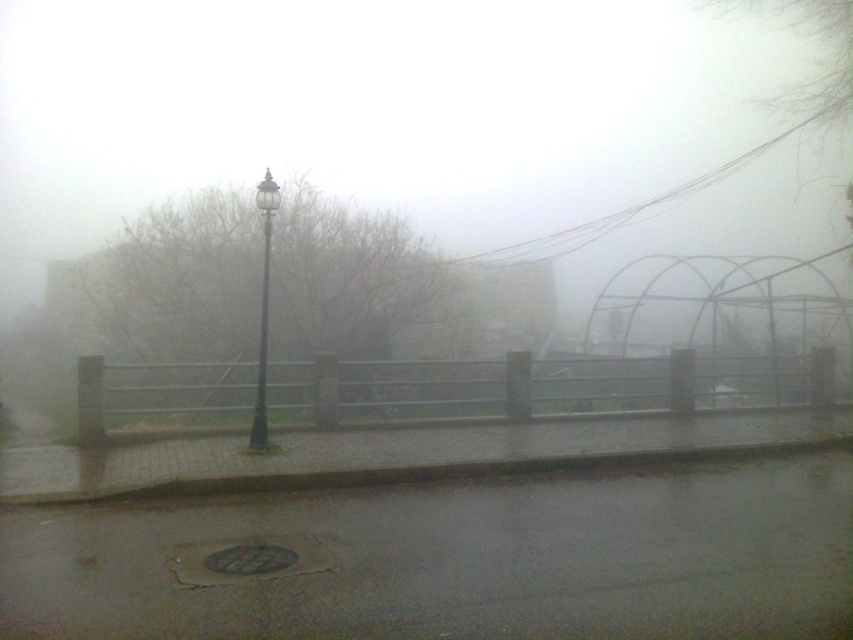
You are a delivery person with a cart that is 5 meters wide. You need to move from the wet asphalt at lower center to the black polished pole at center. Can your cart fit through the space between them?

The distance between the wet asphalt at lower center and the black polished pole at center is 5.03 meters, so the cart which is 5 meters wide can fit through the space between them as it is slightly wider than the cart.

You are a delivery person trying to avoid getting your shoes wet. You see the wet asphalt at lower center and the black polished street light at center. Which object should you step on to stay dry?

The black polished street light at center is above the wet asphalt at lower center, so stepping on the black polished street light at center would keep your shoes dry.